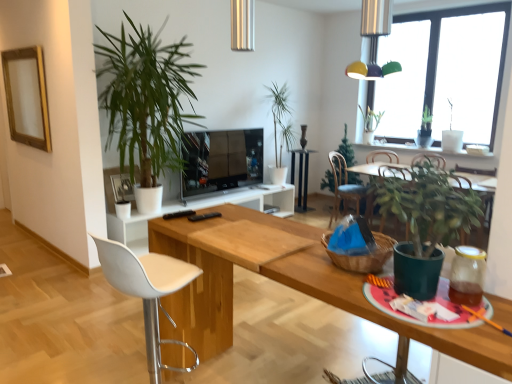
Question: Is flat screen tv at center bigger or smaller than green matte plant at right, which is the fifth houseplant in back-to-front order?

Choices:
 (A) small
 (B) big

Answer: (B)

Question: From a real-world perspective, relative to green matte plant at right, which is the third houseplant from right to left, is flat screen tv at center vertically above or below?

Choices:
 (A) below
 (B) above

Answer: (A)

Question: Considering the real-world distances, which object is closest to the blue fabric chair at center, which is counted as the 1th chair, starting from the right?

Choices:
 (A) green leafy plant at center, which is the third houseplant in back-to-front order
 (B) white leather chair at center, the first chair from the left
 (C) multicolored plastic light fixture at upper right
 (D) wooden table at center
 (E) green matte plant at upper right, arranged as the 1th houseplant when viewed from the right

Answer: (E)

Question: Based on their relative distances, which object is nearer to the green leafy plant at left, the second houseplant viewed from the front?

Choices:
 (A) wooden table at center
 (B) green matte plant at center, the 2th houseplant when ordered from back to front
 (C) brown woven basket at center
 (D) transparent glass window at upper right
 (E) green matte plant at upper right, the fifth houseplant from the front

Answer: (A)